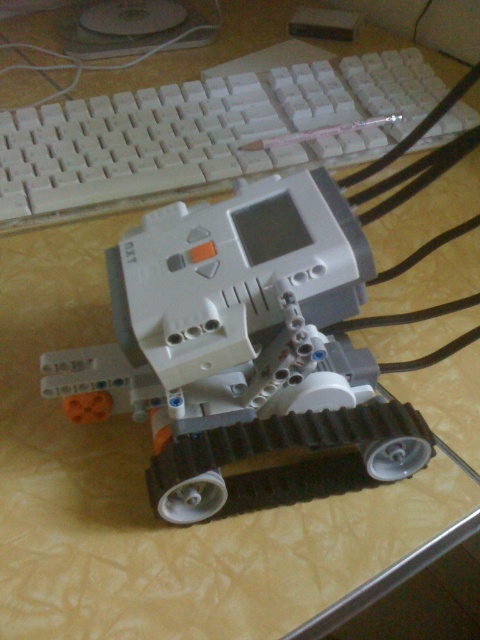
You are standing in front of the LEGO Mindstorms NXT robot on the desk. You notice two points marked on the robot. The first point is at coordinates point (367, 417) and the second is at point (330, 70). If you were to reach out and touch one of them, which point would feel closer to your hand?

Point (367, 417) is closer to the viewer than point (330, 70), so you would feel that point closer to your hand.

You are standing in front of a LEGO Mindstorms NXT robot on a desk. The robot has a central brick with a screen and buttons. You notice a point at coordinates (240, 342). What object is located at that point?

The point at coordinates (240, 342) corresponds to the white plastic robot at center.